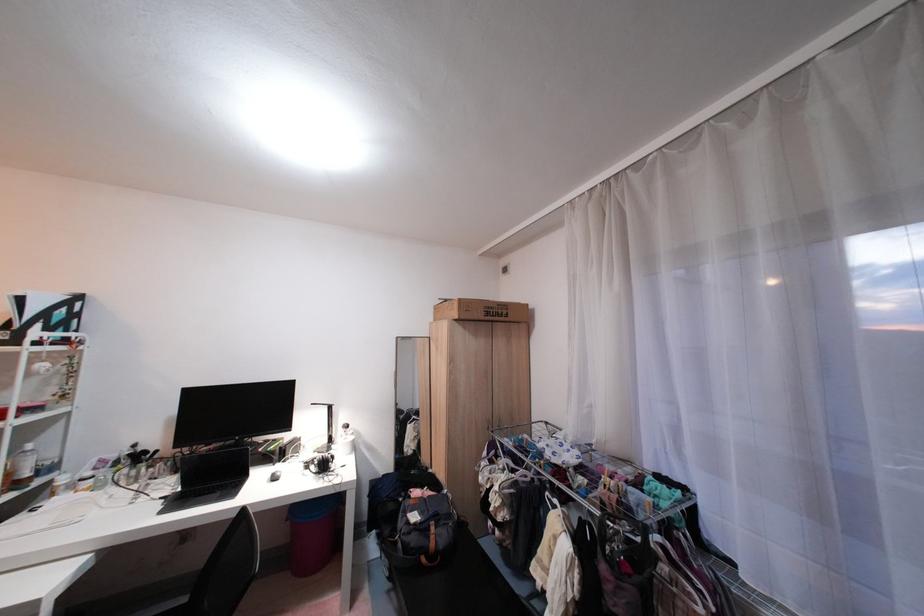
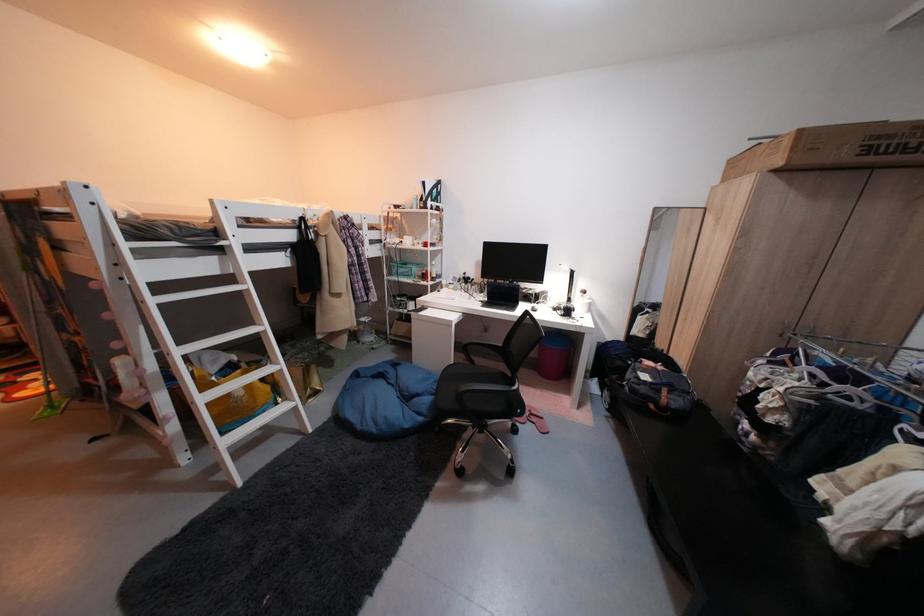
First-person continuous shooting, in which direction is the camera rotating?

The camera rotated toward left-down.